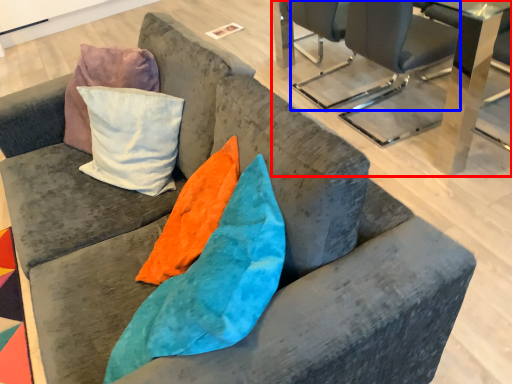
Question: Which point is further to the camera, table (highlighted by a red box) or chair (highlighted by a blue box)?

Choices:
 (A) table
 (B) chair

Answer: (B)